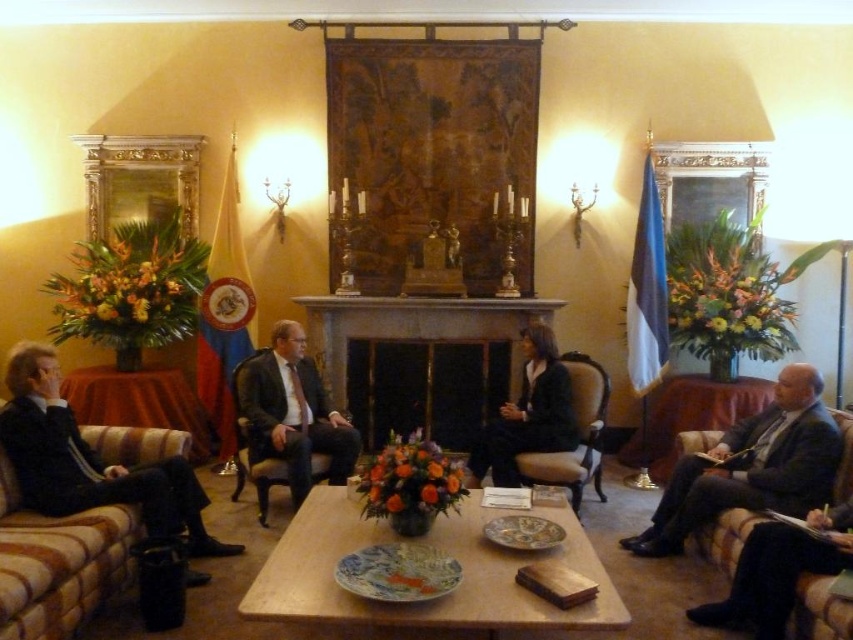
Between dark suit at right and matte black suit at center, which one is positioned lower?

Positioned lower is dark suit at right.

Does dark suit at right appear on the left side of matte black suit at center?

In fact, dark suit at right is to the right of matte black suit at center.

Between point (779, 474) and point (270, 381), which one is positioned in front?

Point (779, 474) is in front.

Identify the location of dark suit at right. (752, 467).

Is point (134, 456) positioned before point (670, 522)?

No, it is not.

Does point (115, 520) come farther from viewer compared to point (767, 496)?

No, (115, 520) is closer to viewer.

The width and height of the screenshot is (853, 640). Find the location of `striped fabric couch at left`. striped fabric couch at left is located at coordinates (59, 563).

Describe the element at coordinates (59, 563) in the screenshot. I see `striped fabric couch at left` at that location.

Where is `striped fabric couch at left`? striped fabric couch at left is located at coordinates (59, 563).